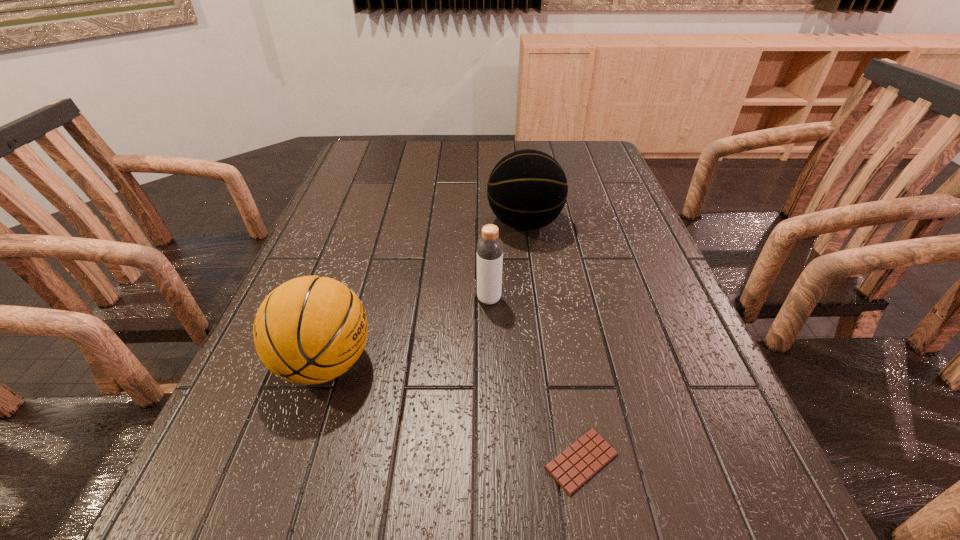
This screenshot has width=960, height=540. Find the location of `free location that satisfies the following two spatial constraints: 1. on the front side of the farther basketball; 2. on the surface of the leftmost object near the brand logo`. free location that satisfies the following two spatial constraints: 1. on the front side of the farther basketball; 2. on the surface of the leftmost object near the brand logo is located at coordinates (543, 363).

I want to click on vacant space that satisfies the following two spatial constraints: 1. on the surface of the leftmost object near the brand logo; 2. on the back side of the nearest object, so click(x=293, y=461).

Locate an element on the screen. This screenshot has height=540, width=960. blank area in the image that satisfies the following two spatial constraints: 1. on the surface of the shortest object near the brand logo; 2. on the left side of the left basketball is located at coordinates click(x=293, y=461).